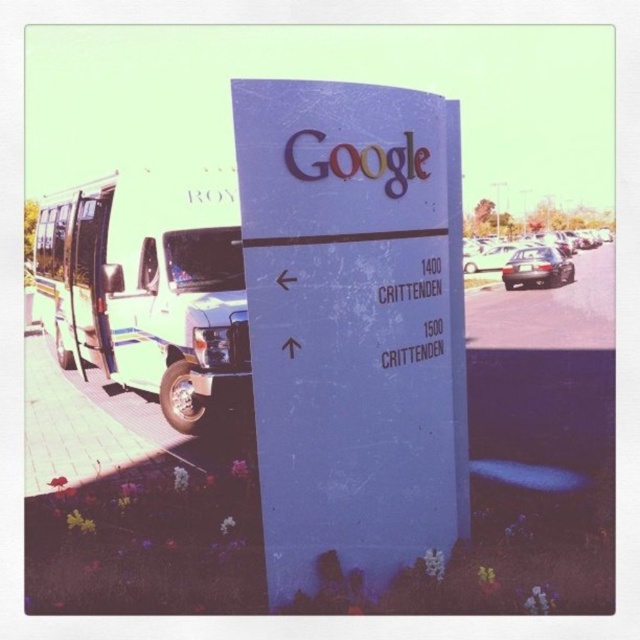
Question: Can you confirm if white matte sign at center is positioned to the left of metallic silver sedan at right?

Choices:
 (A) yes
 (B) no

Answer: (A)

Question: Which object is farther from the camera taking this photo?

Choices:
 (A) white matte sign at center
 (B) shiny black sedan at right
 (C) shiny silver sedan at center
 (D) metallic silver sedan at right

Answer: (D)

Question: Does shiny black sedan at right appear on the left side of shiny silver sedan at center?

Choices:
 (A) yes
 (B) no

Answer: (B)

Question: Which object is farther from the camera taking this photo?

Choices:
 (A) shiny silver sedan at center
 (B) white matte sign at center
 (C) white metallic van at left

Answer: (C)

Question: Among these objects, which one is farthest from the camera?

Choices:
 (A) shiny silver sedan at center
 (B) shiny black sedan at right
 (C) white matte sign at center

Answer: (B)

Question: Can you confirm if white matte sign at center is positioned to the right of shiny silver sedan at center?

Choices:
 (A) no
 (B) yes

Answer: (A)